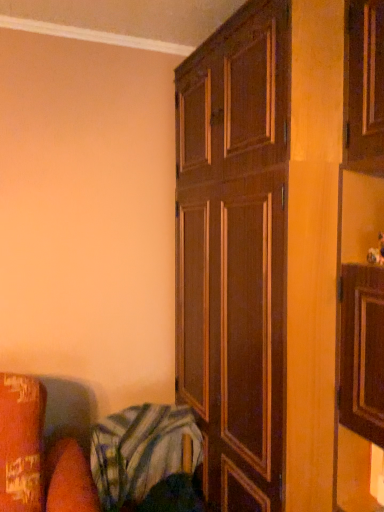
Question: Do you think striped cotton blanket at lower left is within dark wood cupboard at center, or outside of it?

Choices:
 (A) inside
 (B) outside

Answer: (B)

Question: Is striped cotton blanket at lower left taller or shorter than dark wood cupboard at center?

Choices:
 (A) tall
 (B) short

Answer: (B)

Question: In terms of width, does striped cotton blanket at lower left look wider or thinner when compared to dark wood cupboard at center?

Choices:
 (A) wide
 (B) thin

Answer: (B)

Question: Is dark wood cupboard at center bigger or smaller than striped cotton blanket at lower left?

Choices:
 (A) big
 (B) small

Answer: (A)

Question: Is point (331, 140) closer or farther from the camera than point (170, 424)?

Choices:
 (A) farther
 (B) closer

Answer: (B)

Question: Is dark wood cupboard at center spatially inside striped cotton blanket at lower left, or outside of it?

Choices:
 (A) inside
 (B) outside

Answer: (B)

Question: Is dark wood cupboard at center taller or shorter than striped cotton blanket at lower left?

Choices:
 (A) tall
 (B) short

Answer: (A)